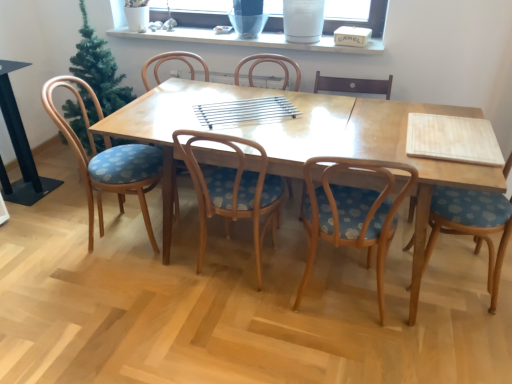
The image size is (512, 384). I want to click on vacant space to the left of wooden chair with blue floral cushion at center, acting as the 5th chair starting from the left, so click(x=239, y=330).